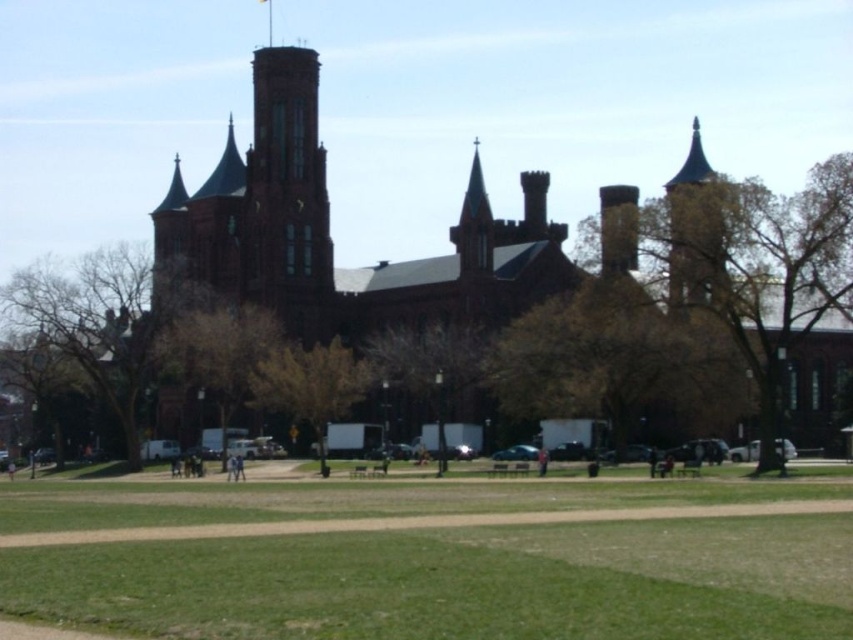
Question: Which object appears closest to the camera in this image?

Choices:
 (A) red brick church at center
 (B) brown stone tower at upper right
 (C) green grass at lower center

Answer: (C)

Question: Which point is closer to the camera?

Choices:
 (A) red brick church at center
 (B) brown stone tower at upper right
 (C) green grass at lower center

Answer: (C)

Question: Does green grass at lower center have a larger size compared to brown stone tower at upper right?

Choices:
 (A) yes
 (B) no

Answer: (B)

Question: Is green grass at lower center thinner than brown stone tower at upper right?

Choices:
 (A) no
 (B) yes

Answer: (A)

Question: Among these points, which one is nearest to the camera?

Choices:
 (A) (553, 632)
 (B) (491, 269)
 (C) (686, 164)

Answer: (A)

Question: Is red brick church at center behind brown stone tower at upper right?

Choices:
 (A) no
 (B) yes

Answer: (B)